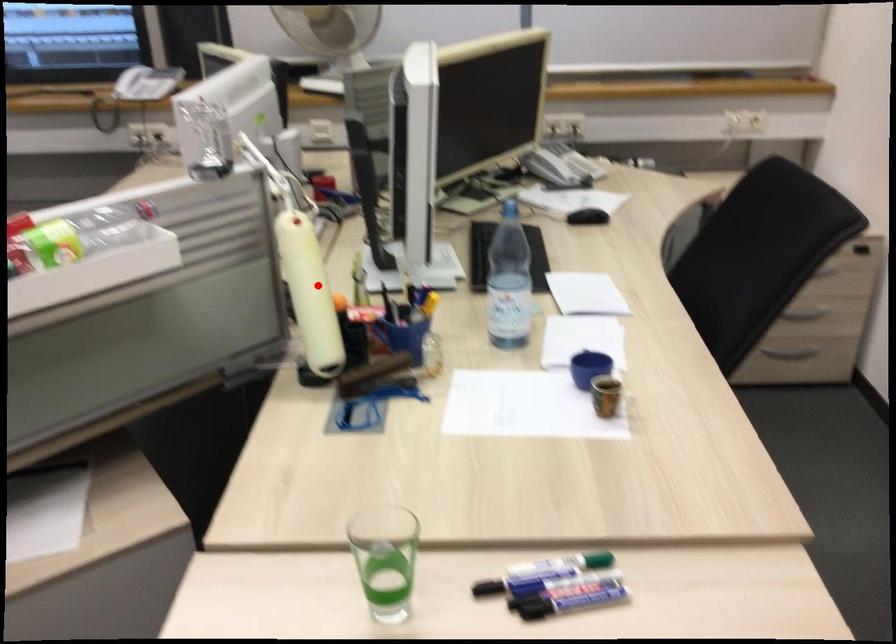
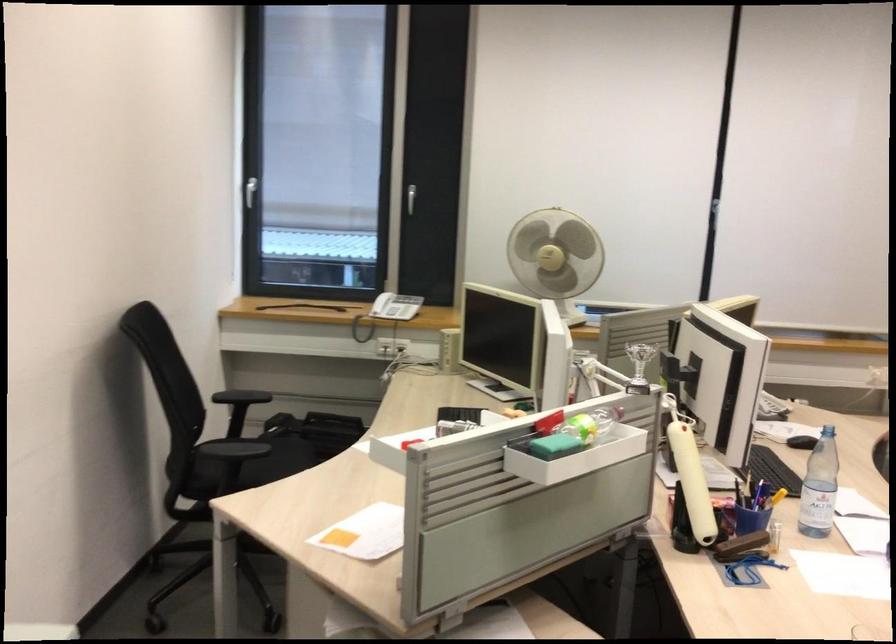
Question: I am providing you with two images of the same scene from different viewpoints. Given a red point in image1, look at the same physical point in image2. Is it:

Choices:
 (A) Closer to the viewpoint
 (B) Farther from the viewpoint

Answer: (B)